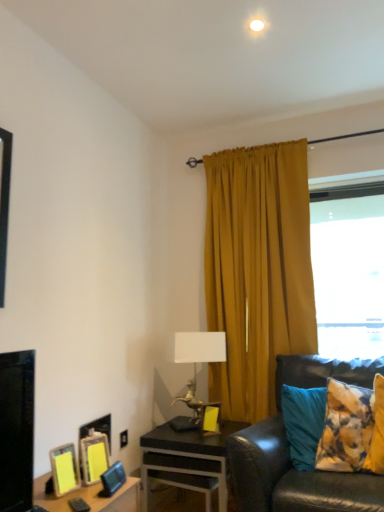
Question: Does metallic horse-shaped lamp at center have a greater width compared to black leather couch at right?

Choices:
 (A) yes
 (B) no

Answer: (B)

Question: Can you confirm if metallic horse-shaped lamp at center is positioned to the right of black leather couch at right?

Choices:
 (A) no
 (B) yes

Answer: (A)

Question: Would you say metallic horse-shaped lamp at center contains black leather couch at right?

Choices:
 (A) yes
 (B) no

Answer: (B)

Question: Does metallic horse-shaped lamp at center have a greater height compared to black leather couch at right?

Choices:
 (A) yes
 (B) no

Answer: (B)

Question: From a real-world perspective, is metallic horse-shaped lamp at center located higher than black leather couch at right?

Choices:
 (A) no
 (B) yes

Answer: (B)

Question: Is point (273, 301) closer or farther from the camera than point (61, 458)?

Choices:
 (A) closer
 (B) farther

Answer: (B)

Question: Which is correct: mustard fabric curtain at upper right is inside yellow paper at lower left, which is the second picture frame from left to right, or outside of it?

Choices:
 (A) inside
 (B) outside

Answer: (B)

Question: In terms of size, does mustard fabric curtain at upper right appear bigger or smaller than yellow paper at lower left, acting as the 4th picture frame starting from the right?

Choices:
 (A) small
 (B) big

Answer: (B)

Question: From a real-world perspective, relative to yellow paper at lower left, acting as the 4th picture frame starting from the right, is mustard fabric curtain at upper right vertically above or below?

Choices:
 (A) above
 (B) below

Answer: (A)

Question: From the image's perspective, is yellow matte picture frame at center, which is counted as the 1th picture frame, starting from the right, above or below black glossy desk at lower center?

Choices:
 (A) below
 (B) above

Answer: (B)

Question: Is yellow matte picture frame at center, which ranks as the 1th picture frame in back-to-front order, inside the boundaries of black glossy desk at lower center, or outside?

Choices:
 (A) outside
 (B) inside

Answer: (A)

Question: Looking at their shapes, would you say yellow matte picture frame at center, which is counted as the 1th picture frame, starting from the right, is wider or thinner than black glossy desk at lower center?

Choices:
 (A) wide
 (B) thin

Answer: (B)

Question: In terms of size, does yellow matte picture frame at center, acting as the fifth picture frame starting from the left, appear bigger or smaller than black glossy desk at lower center?

Choices:
 (A) small
 (B) big

Answer: (A)

Question: From the image's perspective, is metallic horse-shaped lamp at center positioned above or below mustard fabric curtain at upper right?

Choices:
 (A) below
 (B) above

Answer: (A)

Question: Looking at the image, does metallic horse-shaped lamp at center seem bigger or smaller compared to mustard fabric curtain at upper right?

Choices:
 (A) small
 (B) big

Answer: (A)